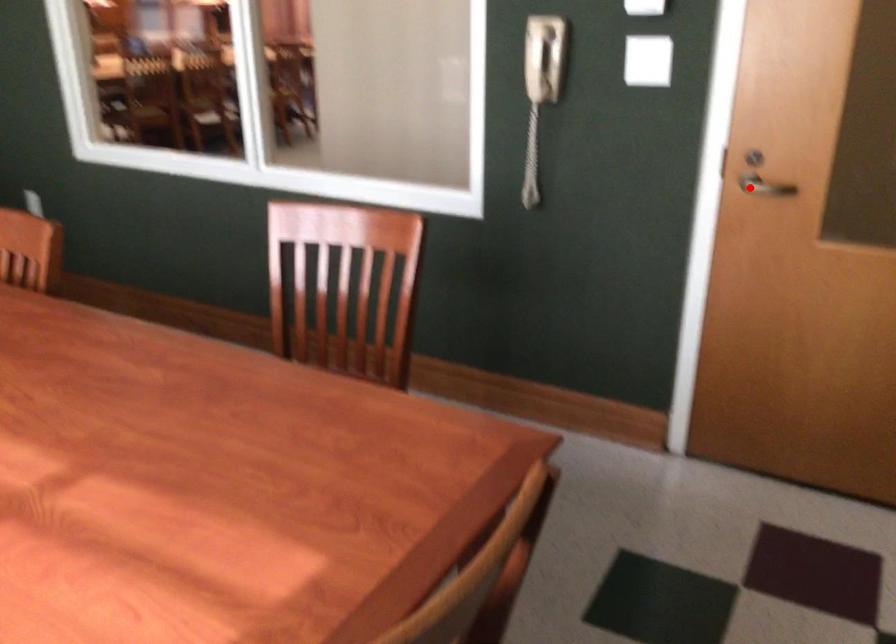
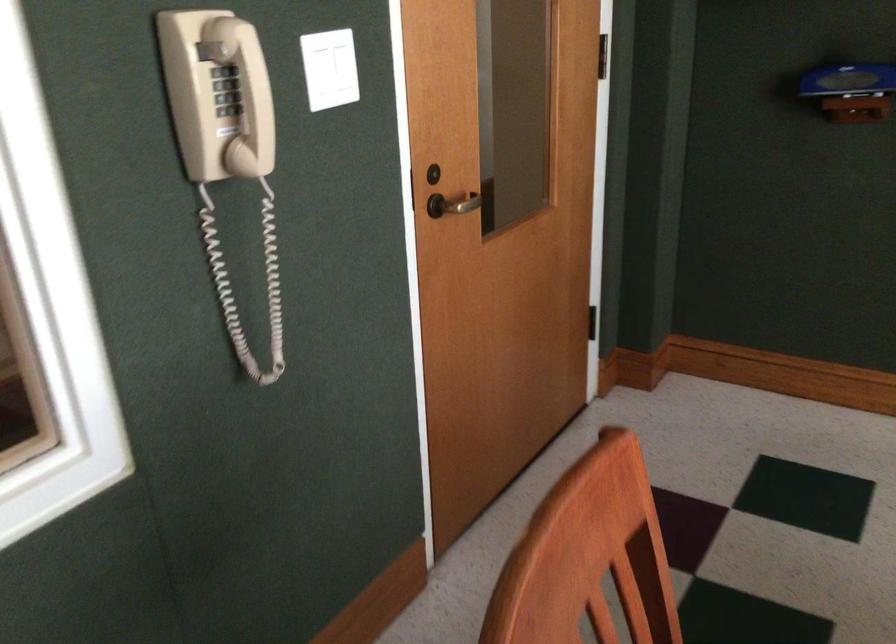
Find the pixel in the second image that matches the highlighted location in the first image.

(458, 204)